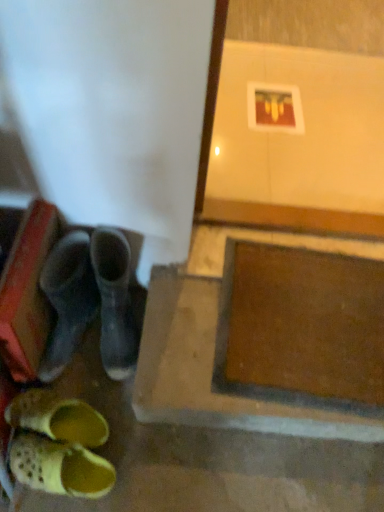
The height and width of the screenshot is (512, 384). Identify the location of brown matte concrete at lower right. (211, 372).

The width and height of the screenshot is (384, 512). What do you see at coordinates (211, 372) in the screenshot?
I see `brown matte concrete at lower right` at bounding box center [211, 372].

The image size is (384, 512). What do you see at coordinates (59, 467) in the screenshot?
I see `yellow mesh clog at lower left` at bounding box center [59, 467].

The width and height of the screenshot is (384, 512). What are the coordinates of `yellow mesh clog at lower left` in the screenshot? It's located at pyautogui.click(x=59, y=467).

The image size is (384, 512). I want to click on brown matte concrete at lower right, so [x=211, y=372].

Between yellow mesh clog at lower left and brown matte concrete at lower right, which one appears on the left side from the viewer's perspective?

yellow mesh clog at lower left.

Considering the relative positions of yellow mesh clog at lower left and brown matte concrete at lower right in the image provided, is yellow mesh clog at lower left behind brown matte concrete at lower right?

No, yellow mesh clog at lower left is closer to the viewer.

Considering the points (32, 443) and (226, 402), which point is in front, point (32, 443) or point (226, 402)?

Positioned in front is point (226, 402).

From the image's perspective, which one is positioned higher, yellow mesh clog at lower left or brown matte concrete at lower right?

brown matte concrete at lower right appears higher in the image.

From a real-world perspective, is yellow mesh clog at lower left on top of brown matte concrete at lower right?

No, from a real-world perspective, yellow mesh clog at lower left is not above brown matte concrete at lower right.

Looking at their sizes, would you say yellow mesh clog at lower left is wider or thinner than brown matte concrete at lower right?

Clearly, yellow mesh clog at lower left has less width compared to brown matte concrete at lower right.

Is yellow mesh clog at lower left shorter than brown matte concrete at lower right?

Yes, yellow mesh clog at lower left is shorter than brown matte concrete at lower right.

Between yellow mesh clog at lower left and brown matte concrete at lower right, which one has smaller size?

yellow mesh clog at lower left is smaller.

Is yellow mesh clog at lower left inside the boundaries of brown matte concrete at lower right, or outside?

yellow mesh clog at lower left exists outside the volume of brown matte concrete at lower right.

Would you consider yellow mesh clog at lower left to be distant from brown matte concrete at lower right?

yellow mesh clog at lower left is actually quite close to brown matte concrete at lower right.

Is yellow mesh clog at lower left positioned with its back to brown matte concrete at lower right?

No, yellow mesh clog at lower left is not facing away from brown matte concrete at lower right.

Locate an element on the screen. footwear below the brown matte concrete at lower right (from a real-world perspective) is located at coordinates (59, 467).

Between brown matte concrete at lower right and yellow mesh clog at lower left, which one appears on the right side from the viewer's perspective?

From the viewer's perspective, brown matte concrete at lower right appears more on the right side.

Considering the positions of objects brown matte concrete at lower right and yellow mesh clog at lower left in the image provided, who is behind, brown matte concrete at lower right or yellow mesh clog at lower left?

brown matte concrete at lower right is further from the camera.

Which is closer to the camera, [159,326] or [45,457]?

Point [45,457]

Looking at this image, from the image's perspective, which one is positioned higher, brown matte concrete at lower right or yellow mesh clog at lower left?

brown matte concrete at lower right appears higher in the image.

From a real-world perspective, is brown matte concrete at lower right physically located above or below yellow mesh clog at lower left?

brown matte concrete at lower right is situated higher than yellow mesh clog at lower left in the real world.

Is brown matte concrete at lower right wider than yellow mesh clog at lower left?

Yes, brown matte concrete at lower right is wider than yellow mesh clog at lower left.

Does brown matte concrete at lower right have a greater height compared to yellow mesh clog at lower left?

Yes.

Which of these two, brown matte concrete at lower right or yellow mesh clog at lower left, is smaller?

With smaller size is yellow mesh clog at lower left.

Could yellow mesh clog at lower left be considered to be inside brown matte concrete at lower right?

Result: That's incorrect, yellow mesh clog at lower left is not inside brown matte concrete at lower right.

Is there a large distance between brown matte concrete at lower right and yellow mesh clog at lower left?

brown matte concrete at lower right is actually quite close to yellow mesh clog at lower left.

Is yellow mesh clog at lower left at the back of brown matte concrete at lower right?

No, brown matte concrete at lower right's orientation is not away from yellow mesh clog at lower left.

Locate an element on the screen. Image resolution: width=384 pixels, height=512 pixels. concrete located above the yellow mesh clog at lower left (from a real-world perspective) is located at coordinates (211, 372).

In the image, there is a yellow mesh clog at lower left. At what (x,y) coordinates should I click in order to perform the action: click on concrete above it (from the image's perspective). Please return your answer as a coordinate pair (x, y). This screenshot has height=512, width=384. Looking at the image, I should click on (211, 372).

You are a GUI agent. You are given a task and a screenshot of the screen. Output one action in this format:
    pyautogui.click(x=<x>, y=<y>)
    Task: Click on the concrete on the right of the yellow mesh clog at lower left
    This screenshot has width=384, height=512.
    Given the screenshot: What is the action you would take?
    pyautogui.click(x=211, y=372)